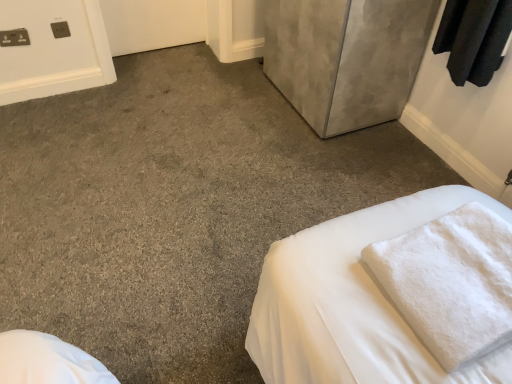
Measure the distance between point (403, 54) and camera.

Point (403, 54) is 2.14 meters away from camera.

The image size is (512, 384). Describe the element at coordinates (346, 58) in the screenshot. I see `matte gray cabinet at upper right` at that location.

In order to face matte gray cabinet at upper right, should I rotate leftwards or rightwards?

To align with it, rotate right about 11.268°.

Find the location of a particular element. The width and height of the screenshot is (512, 384). matte gray cabinet at upper right is located at coordinates (346, 58).

What is the approximate width of matte gray cabinet at upper right?

It is 22.24 inches.

What do you see at coordinates (451, 282) in the screenshot?
I see `white fluffy bath towel at lower right` at bounding box center [451, 282].

This screenshot has width=512, height=384. What are the coordinates of `white fluffy bath towel at lower right` in the screenshot? It's located at (451, 282).

This screenshot has height=384, width=512. What are the coordinates of `matte gray cabinet at upper right` in the screenshot? It's located at (346, 58).

Considering the relative positions of matte gray cabinet at upper right and white fluffy bath towel at lower right in the image provided, is matte gray cabinet at upper right to the right of white fluffy bath towel at lower right from the viewer's perspective?

No, matte gray cabinet at upper right is not to the right of white fluffy bath towel at lower right.

Is matte gray cabinet at upper right positioned in front of white fluffy bath towel at lower right?

No, matte gray cabinet at upper right is behind white fluffy bath towel at lower right.

Is point (329, 91) farther from camera compared to point (425, 247)?

That is True.

From the image's perspective, which object appears higher, matte gray cabinet at upper right or white fluffy bath towel at lower right?

From the image's view, matte gray cabinet at upper right is above.

Based on the photo, from a real-world perspective, is matte gray cabinet at upper right on top of white fluffy bath towel at lower right?

No.

Looking at their sizes, would you say matte gray cabinet at upper right is wider or thinner than white fluffy bath towel at lower right?

In the image, matte gray cabinet at upper right appears to be wider than white fluffy bath towel at lower right.

Is matte gray cabinet at upper right shorter than white fluffy bath towel at lower right?

Incorrect, the height of matte gray cabinet at upper right does not fall short of that of white fluffy bath towel at lower right.

Considering the relative sizes of matte gray cabinet at upper right and white fluffy bath towel at lower right in the image provided, is matte gray cabinet at upper right bigger than white fluffy bath towel at lower right?

Yes.

Is white fluffy bath towel at lower right located within matte gray cabinet at upper right?

No, white fluffy bath towel at lower right is located outside of matte gray cabinet at upper right.

Are matte gray cabinet at upper right and white fluffy bath towel at lower right far apart?

matte gray cabinet at upper right is positioned a significant distance from white fluffy bath towel at lower right.

Is matte gray cabinet at upper right facing away from white fluffy bath towel at lower right?

That's not correct — matte gray cabinet at upper right is not looking away from white fluffy bath towel at lower right.

How many degrees apart are the facing directions of matte gray cabinet at upper right and white fluffy bath towel at lower right?

The angular difference between matte gray cabinet at upper right and white fluffy bath towel at lower right is 88.7 degrees.

How much distance is there between matte gray cabinet at upper right and white fluffy bath towel at lower right?

matte gray cabinet at upper right is 4.03 feet away from white fluffy bath towel at lower right.

Where is `bath towel in front of the matte gray cabinet at upper right`? The height and width of the screenshot is (384, 512). bath towel in front of the matte gray cabinet at upper right is located at coordinates (451, 282).

Considering the relative positions of white fluffy bath towel at lower right and matte gray cabinet at upper right in the image provided, is white fluffy bath towel at lower right to the left of matte gray cabinet at upper right from the viewer's perspective?

No.

Which object is further away from the camera taking this photo, white fluffy bath towel at lower right or matte gray cabinet at upper right?

Positioned behind is matte gray cabinet at upper right.

Is point (483, 318) in front of point (351, 81)?

Yes, it is in front of point (351, 81).

From the image's perspective, is white fluffy bath towel at lower right above or below matte gray cabinet at upper right?

white fluffy bath towel at lower right is below matte gray cabinet at upper right.

From a real-world perspective, is white fluffy bath towel at lower right positioned above or below matte gray cabinet at upper right?

In terms of real-world spatial position, white fluffy bath towel at lower right is above matte gray cabinet at upper right.

In the scene shown: Between white fluffy bath towel at lower right and matte gray cabinet at upper right, which one has smaller width?

With smaller width is white fluffy bath towel at lower right.

Considering the sizes of objects white fluffy bath towel at lower right and matte gray cabinet at upper right in the image provided, who is taller, white fluffy bath towel at lower right or matte gray cabinet at upper right?

Standing taller between the two is matte gray cabinet at upper right.

Which of these two, white fluffy bath towel at lower right or matte gray cabinet at upper right, is bigger?

matte gray cabinet at upper right.

Consider the image. Is white fluffy bath towel at lower right completely or partially outside of matte gray cabinet at upper right?

white fluffy bath towel at lower right is positioned outside matte gray cabinet at upper right.

Is white fluffy bath towel at lower right far away from matte gray cabinet at upper right?

Yes, white fluffy bath towel at lower right and matte gray cabinet at upper right are quite far apart.

Is matte gray cabinet at upper right at the back of white fluffy bath towel at lower right?

No, white fluffy bath towel at lower right is not facing the opposite direction of matte gray cabinet at upper right.

What's the angular difference between white fluffy bath towel at lower right and matte gray cabinet at upper right's facing directions?

88.7 degrees.

Measure the distance between white fluffy bath towel at lower right and matte gray cabinet at upper right.

white fluffy bath towel at lower right is 1.23 meters away from matte gray cabinet at upper right.

In the image, there is a white fluffy bath towel at lower right. Where is `door above it (from the image's perspective)`? This screenshot has width=512, height=384. door above it (from the image's perspective) is located at coordinates (346, 58).

Where is `bath towel that is in front of the matte gray cabinet at upper right`? bath towel that is in front of the matte gray cabinet at upper right is located at coordinates (451, 282).

The height and width of the screenshot is (384, 512). What are the coordinates of `bath towel positioned vertically above the matte gray cabinet at upper right (from a real-world perspective)` in the screenshot? It's located at (451, 282).